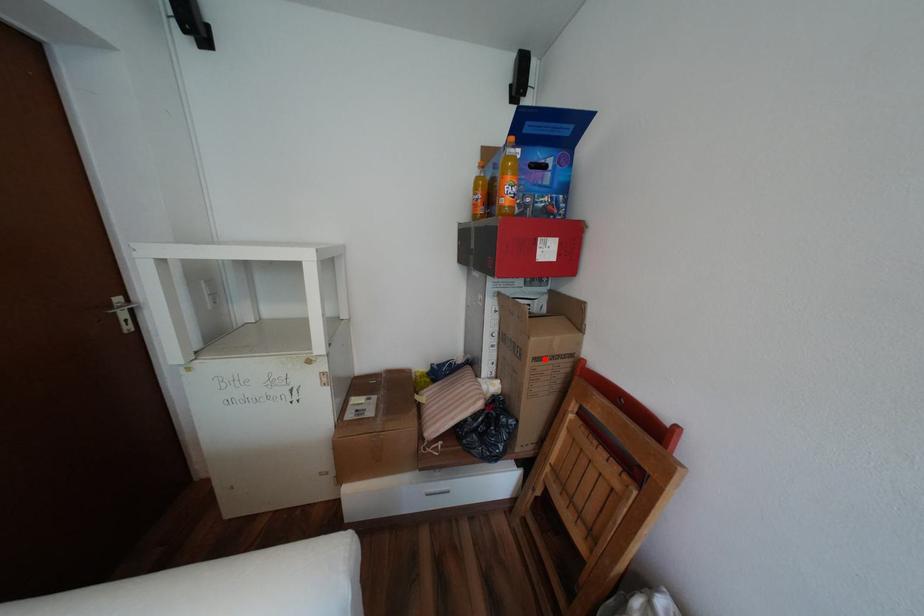
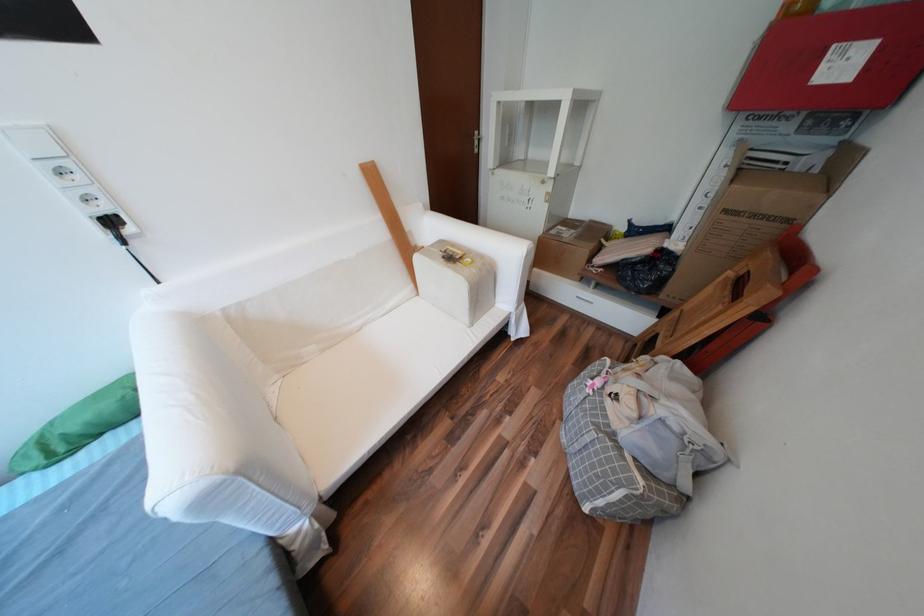
Where in the second image is the point corresponding to the highlighted location from the first image?

(736, 211)